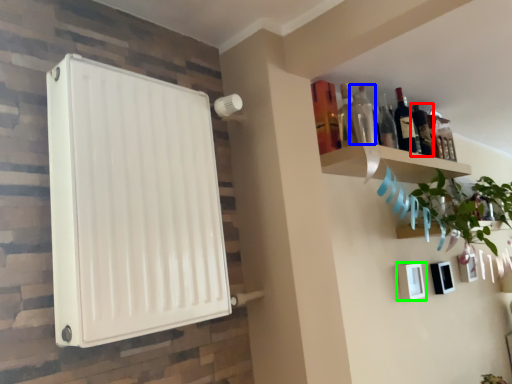
Question: Which is nearer to the bottle (highlighted by a red box)? bottle (highlighted by a blue box) or picture frame (highlighted by a green box).

Choices:
 (A) bottle
 (B) picture frame

Answer: (A)